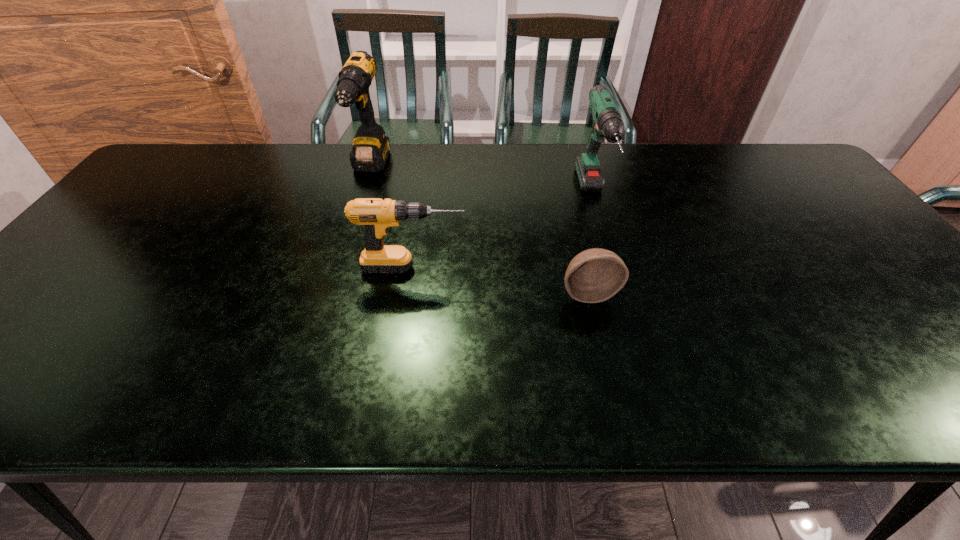
You are a GUI agent. You are given a task and a screenshot of the screen. Output one action in this format:
    pyautogui.click(x=<x>, y=<y>)
    Task: Click on the free space at the far edge of the desktop
    This screenshot has width=960, height=540.
    Given the screenshot: What is the action you would take?
    pyautogui.click(x=313, y=173)

The height and width of the screenshot is (540, 960). In the image, there is a desktop. In order to click on vacant space at the near edge in this screenshot , I will do point(826,375).

Where is `vacant area at the left edge`? The width and height of the screenshot is (960, 540). vacant area at the left edge is located at coordinates (81, 325).

This screenshot has height=540, width=960. What are the coordinates of `vacant position at the right edge of the desktop` in the screenshot? It's located at (794, 192).

I want to click on free space at the far left corner, so click(198, 159).

Identify the location of empty space between the second object from left to right and the rightmost drill. (503, 232).

You are a GUI agent. You are given a task and a screenshot of the screen. Output one action in this format:
    pyautogui.click(x=<x>, y=<y>)
    Task: Click on the vacant area between the leftmost drill and the shortest object
    The image size is (960, 540).
    Given the screenshot: What is the action you would take?
    pyautogui.click(x=479, y=230)

Find the location of a particular element. vacant region between the third object from right to left and the rightmost drill is located at coordinates (503, 232).

Identify the location of vacant area between the nearest object and the rightmost drill. The height and width of the screenshot is (540, 960). (590, 245).

You are a GUI agent. You are given a task and a screenshot of the screen. Output one action in this format:
    pyautogui.click(x=<x>, y=<y>)
    Task: Click on the free spot between the nearest object and the rightmost drill
    
    Given the screenshot: What is the action you would take?
    pyautogui.click(x=590, y=245)